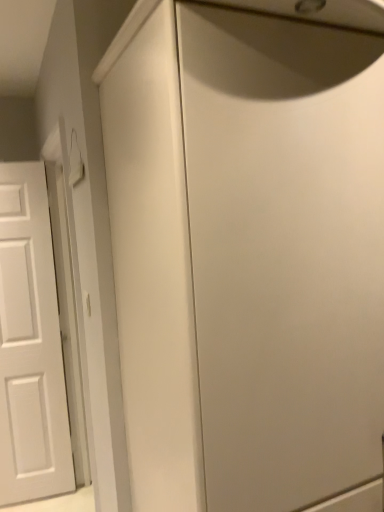
You are a GUI agent. You are given a task and a screenshot of the screen. Output one action in this format:
    pyautogui.click(x=<x>, y=<y>)
    Task: Click on the white matte cabinet at center
    
    Given the screenshot: What is the action you would take?
    [285, 254]

What do you see at coordinates (285, 254) in the screenshot? Image resolution: width=384 pixels, height=512 pixels. I see `white matte cabinet at center` at bounding box center [285, 254].

At what (x,y) coordinates should I click in order to perform the action: click on white matte cabinet at center. Please return your answer as a coordinate pair (x, y). This screenshot has height=512, width=384. Looking at the image, I should click on (285, 254).